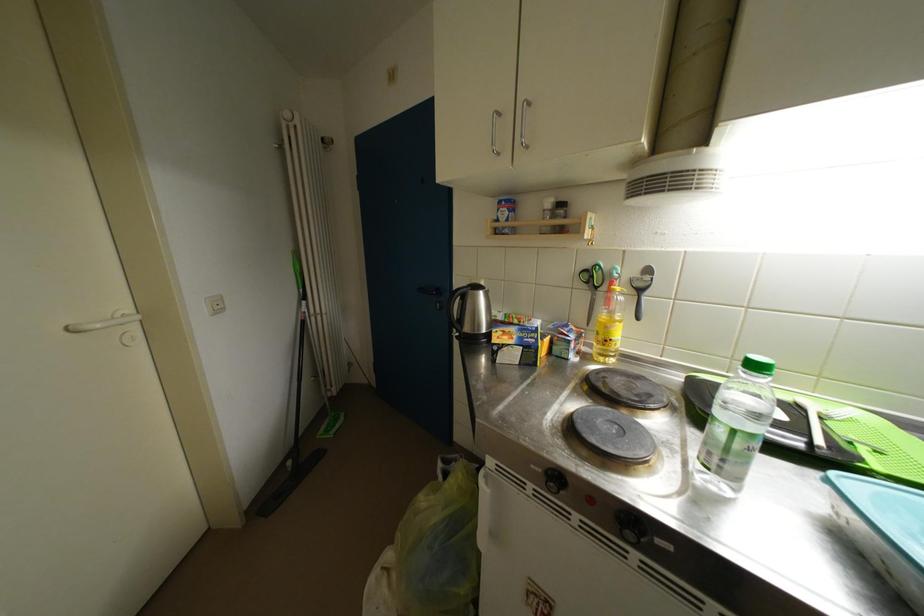
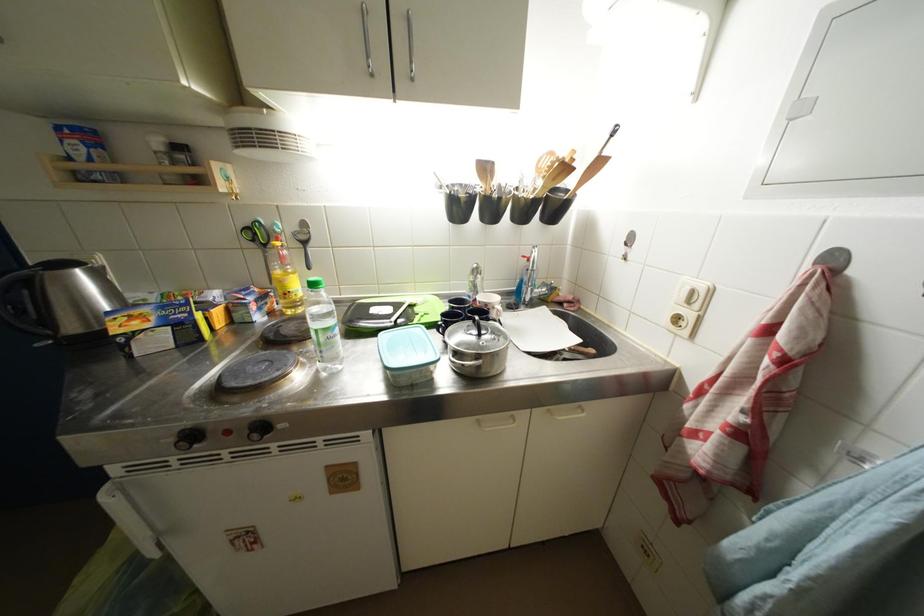
In the second image, find the point that corresponds to the point at 602,292 in the first image.

(272, 249)